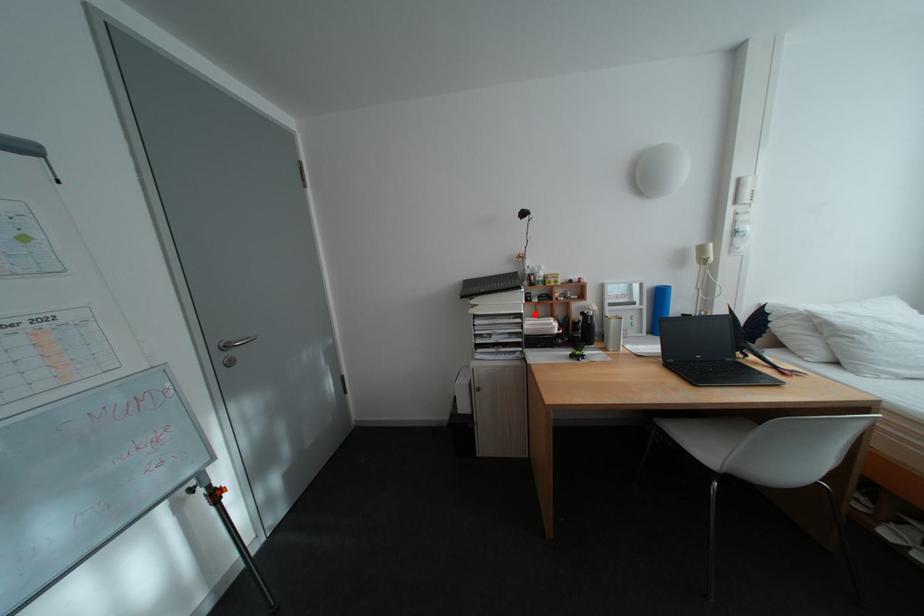
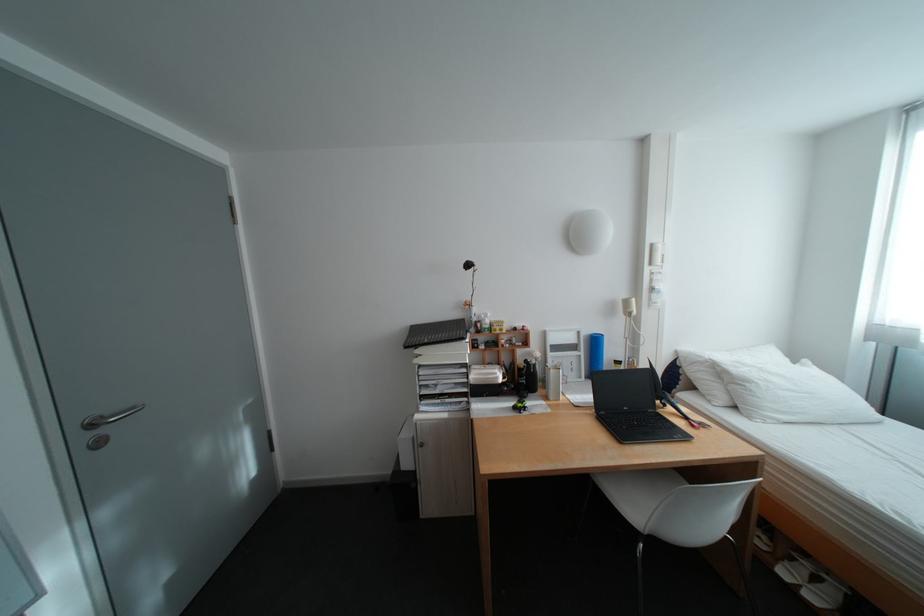
The point at the highlighted location is marked in the first image. Where is the corresponding point in the second image?

(480, 363)